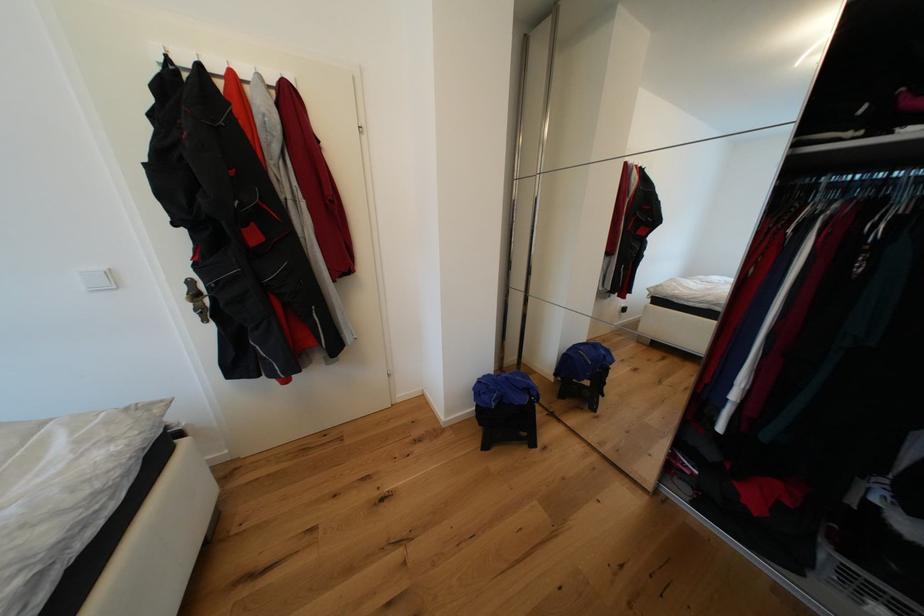
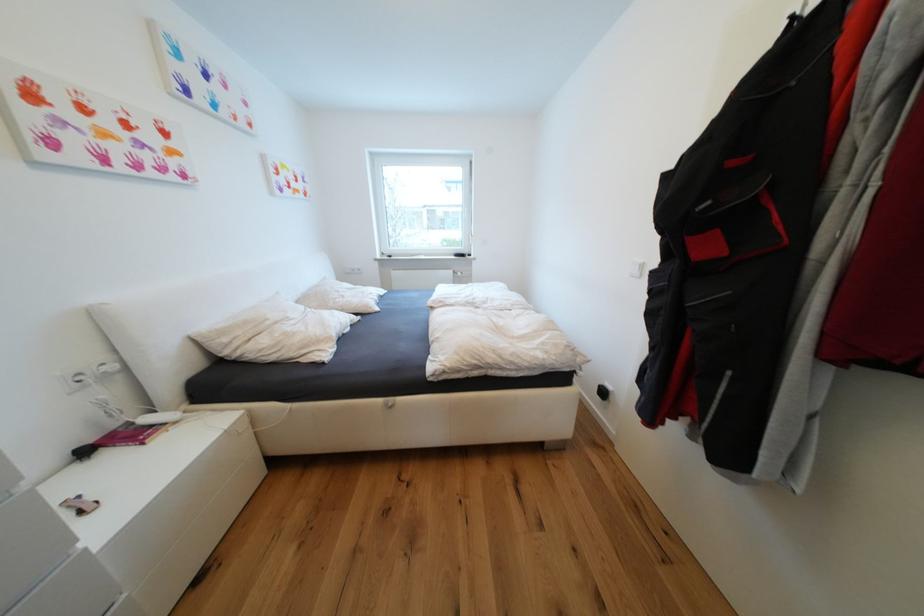
In the second image, find the point that corresponds to the point at 261,238 in the first image.

(714, 249)